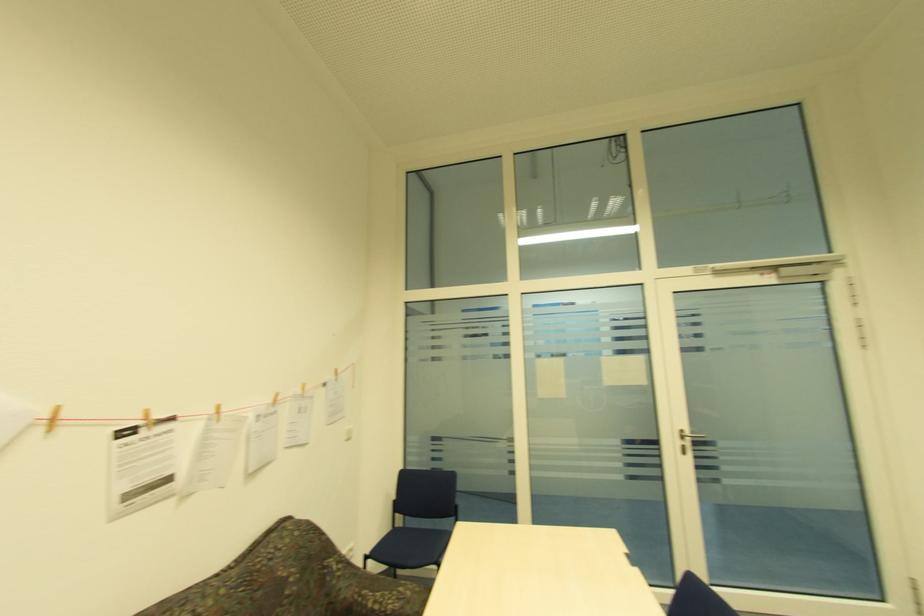
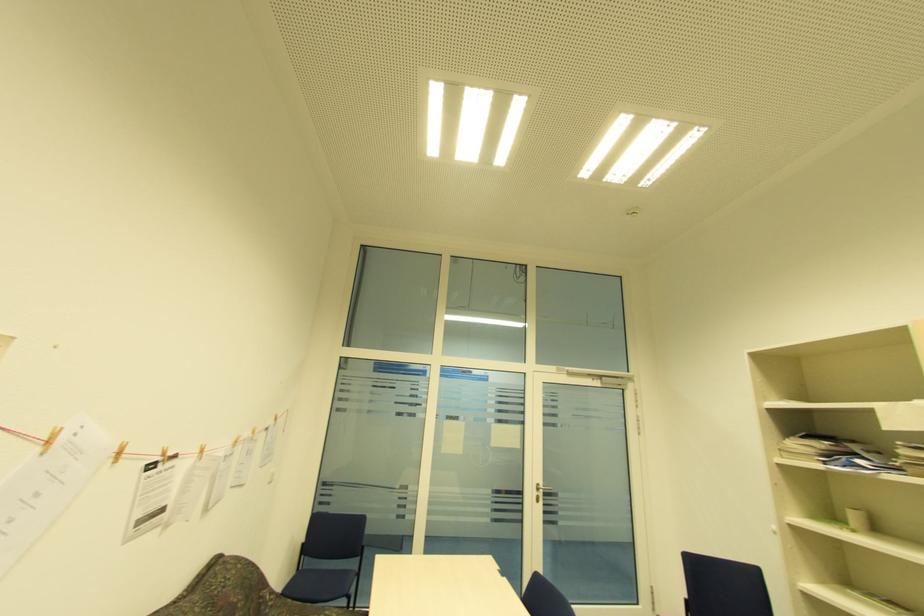
Where in the second image is the point corresponding to point 219,413 from the first image?

(203, 453)